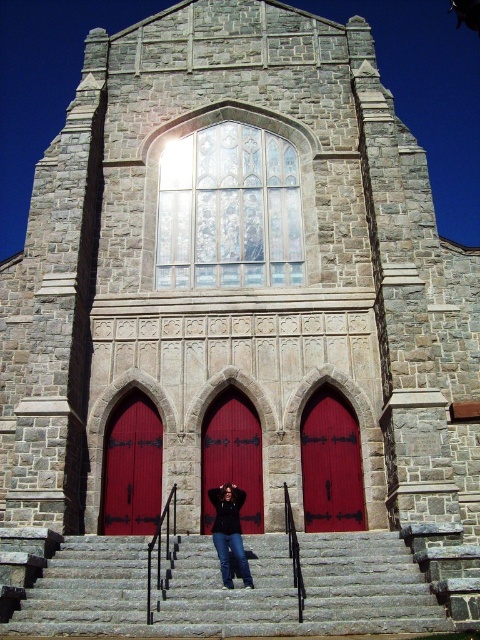
Question: Which point is farther to the camera?

Choices:
 (A) smooth red wooden door at center
 (B) smooth glossy red door at center

Answer: (A)

Question: Which point is farther from the camera taking this photo?

Choices:
 (A) (346, 480)
 (B) (315, 552)

Answer: (A)

Question: Does smooth glossy red door at center appear on the right side of smooth red wooden door at center?

Choices:
 (A) no
 (B) yes

Answer: (B)

Question: Does gray stone stairs at center have a lesser width compared to denim pants at center?

Choices:
 (A) no
 (B) yes

Answer: (A)

Question: Among these objects, which one is farthest from the camera?

Choices:
 (A) smooth red wooden door at center
 (B) smooth glossy wood door at center
 (C) smooth glossy red door at center
 (D) gray stone stairs at center

Answer: (A)

Question: Does smooth glossy wood door at center lie behind denim pants at center?

Choices:
 (A) no
 (B) yes

Answer: (B)